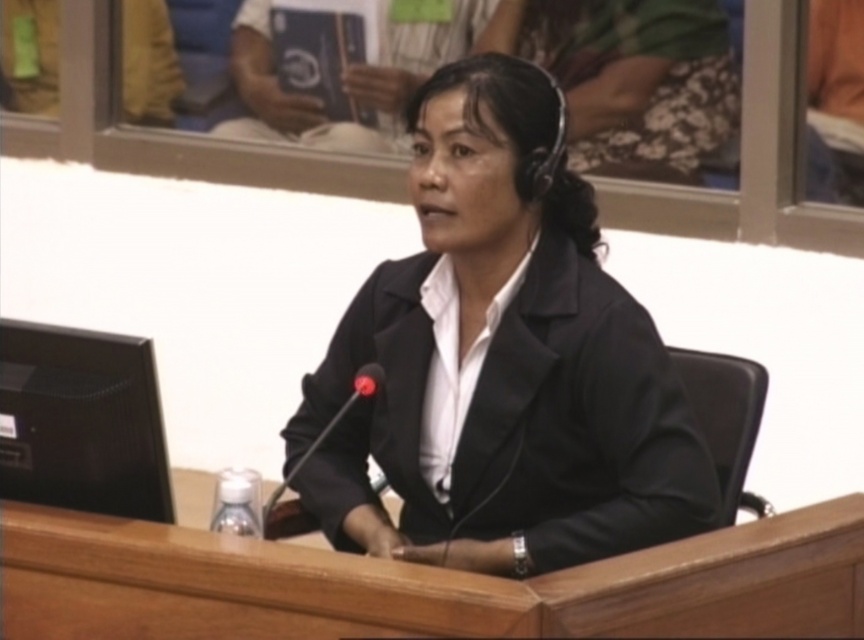
Consider the image. You are an assistant in the courtroom. You need to place two documents on the desk. The first document must be placed at point (353, 413), and the second at point (378, 388). Which document will be closer to the microphone?

The document placed at point (378, 388) is closer to the microphone because point (353, 413) is behind point (378, 388), meaning it is farther away from the microphone.

Consider the image. You are an interior designer planning to place a decorative item on a desk. The desk currently has a black matte suit at center and a black plastic microphone at center. Which object should you avoid placing something on top of if you want to ensure visibility from above?

The black plastic microphone at center is shorter than the black matte suit at center, so placing items on it may block visibility. Avoid placing something on top of the black plastic microphone at center.

You are an assistant in a courtroom. You need to place a document on the desk between the black matte suit at center and the black plastic microphone at center. According to their positions, which object should the document be closer to?

The black matte suit at center is positioned on the right side of the black plastic microphone at center. Therefore, the document should be placed closer to the black plastic microphone at center since the microphone is to the left of the suit.